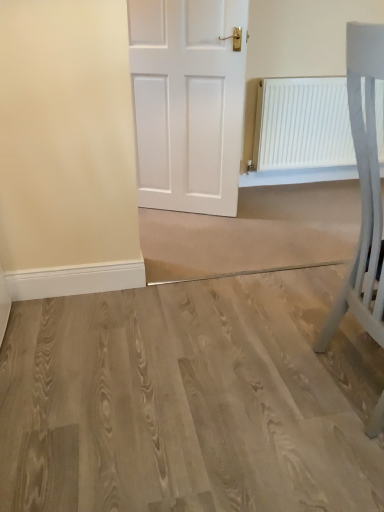
Question: Should I look upward or downward to see white matte chair at right?

Choices:
 (A) up
 (B) down

Answer: (A)

Question: Is white matte chair at right not within light wood floor at center?

Choices:
 (A) no
 (B) yes

Answer: (B)

Question: Is white matte chair at right oriented away from light wood floor at center?

Choices:
 (A) no
 (B) yes

Answer: (A)

Question: From a real-world perspective, is white matte chair at right located higher than light wood floor at center?

Choices:
 (A) no
 (B) yes

Answer: (B)

Question: Can light wood floor at center be found inside white matte chair at right?

Choices:
 (A) yes
 (B) no

Answer: (B)

Question: Can you confirm if white matte chair at right is shorter than light wood floor at center?

Choices:
 (A) yes
 (B) no

Answer: (B)

Question: Considering the relative sizes of white matte chair at right and light wood floor at center in the image provided, is white matte chair at right smaller than light wood floor at center?

Choices:
 (A) no
 (B) yes

Answer: (B)

Question: Is light wood floor at center placed right next to white matte chair at right?

Choices:
 (A) yes
 (B) no

Answer: (B)

Question: Is light wood floor at center further to the viewer compared to white matte chair at right?

Choices:
 (A) yes
 (B) no

Answer: (A)

Question: Does light wood floor at center have a lesser width compared to white matte chair at right?

Choices:
 (A) yes
 (B) no

Answer: (B)

Question: Is light wood floor at center not inside white matte chair at right?

Choices:
 (A) no
 (B) yes

Answer: (B)

Question: Considering the relative positions of light wood floor at center and white matte chair at right in the image provided, is light wood floor at center in front of white matte chair at right?

Choices:
 (A) yes
 (B) no

Answer: (B)

Question: From the image's perspective, would you say light wood floor at center is shown under white matte chair at right?

Choices:
 (A) yes
 (B) no

Answer: (A)

Question: Does white matte chair at right have a larger size compared to white matte radiator at upper right?

Choices:
 (A) yes
 (B) no

Answer: (A)